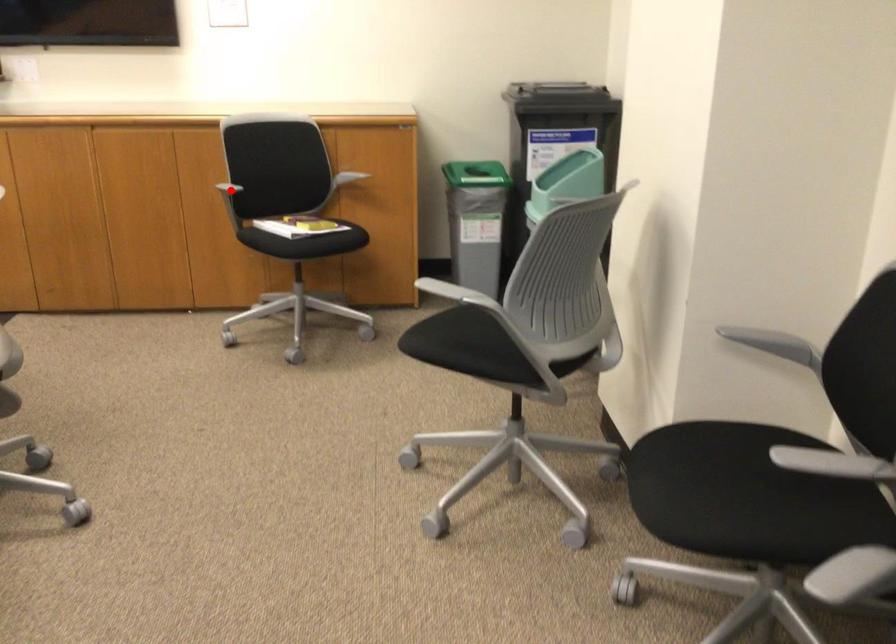
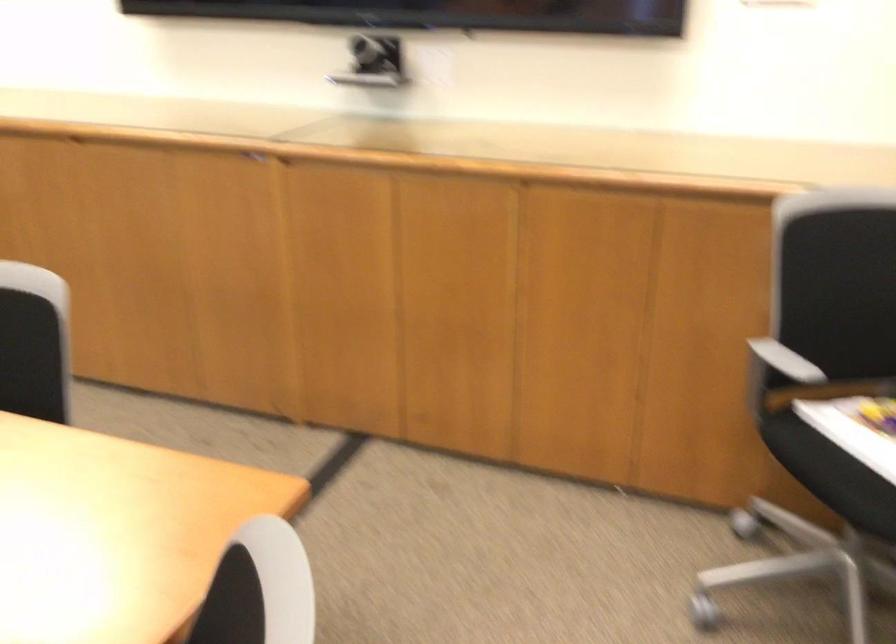
Question: I am providing you with two images of the same scene from different viewpoints. In image1, a red point is highlighted. Considering the same 3D point in image2, which of the following is correct?

Choices:
 (A) It is closer
 (B) It is farther

Answer: (A)